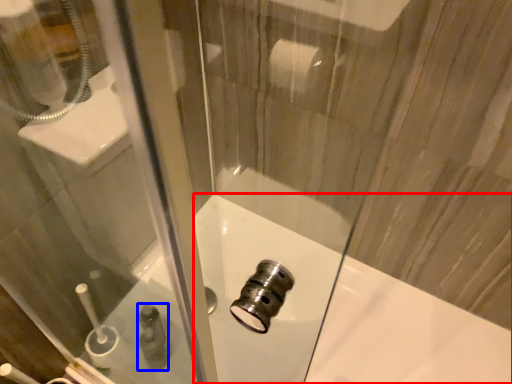
Question: Which object is closer to the camera taking this photo, bath (highlighted by a red box) or toiletry (highlighted by a blue box)?

Choices:
 (A) bath
 (B) toiletry

Answer: (A)